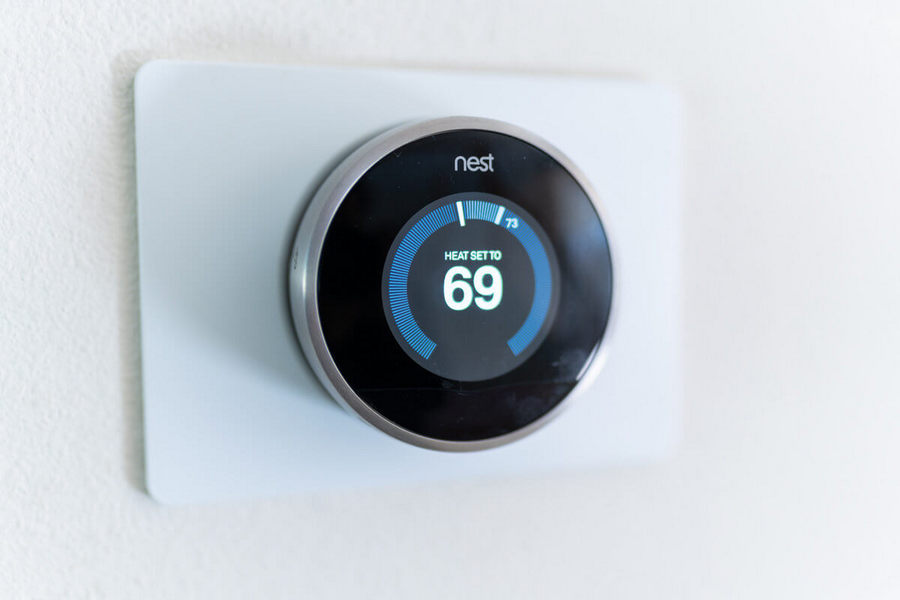
Find the location of a particular element. dirt on thermostat is located at coordinates (462, 416).